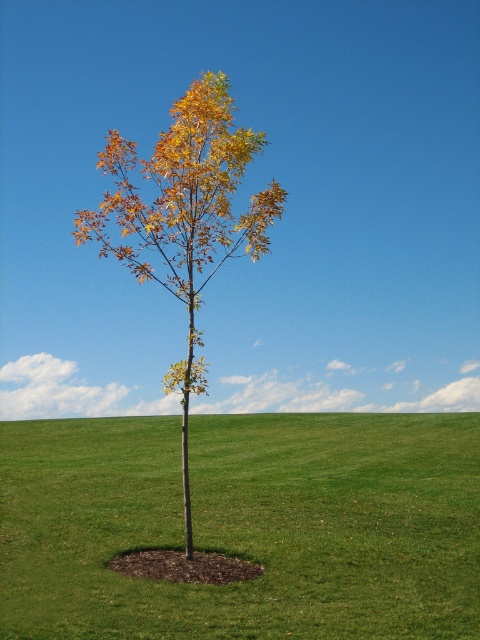
Question: Is green grass at center bigger than yellow-green foliage at center?

Choices:
 (A) no
 (B) yes

Answer: (B)

Question: Is green grass at center to the left of yellow-green foliage at center from the viewer's perspective?

Choices:
 (A) no
 (B) yes

Answer: (A)

Question: In this image, where is green grass at center located relative to yellow-green foliage at center?

Choices:
 (A) below
 (B) above

Answer: (A)